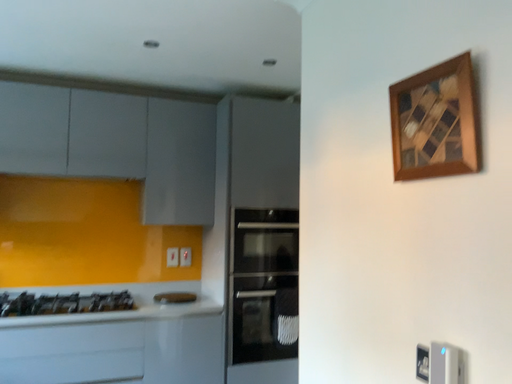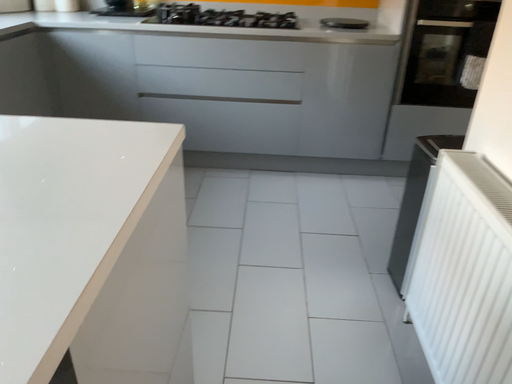
Question: How did the camera likely rotate when shooting the video?

Choices:
 (A) rotated left
 (B) rotated right

Answer: (A)